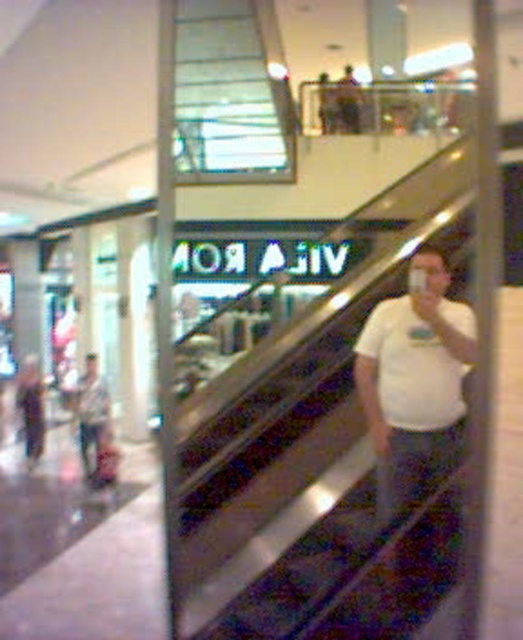
Question: Is white matte t-shirt at center bigger than matte gray shirt at lower left?

Choices:
 (A) yes
 (B) no

Answer: (B)

Question: Can you confirm if white matte t-shirt at center is bigger than matte gray shirt at lower left?

Choices:
 (A) yes
 (B) no

Answer: (B)

Question: Which point is closer to the camera?

Choices:
 (A) [x=435, y=410]
 (B) [x=89, y=353]

Answer: (A)

Question: Which point appears farthest from the camera in this image?

Choices:
 (A) (437, 266)
 (B) (94, 417)

Answer: (B)

Question: Which point appears farthest from the camera in this image?

Choices:
 (A) (450, 372)
 (B) (87, 376)

Answer: (B)

Question: In this image, where is white matte t-shirt at center located relative to matte gray shirt at lower left?

Choices:
 (A) right
 (B) left

Answer: (A)